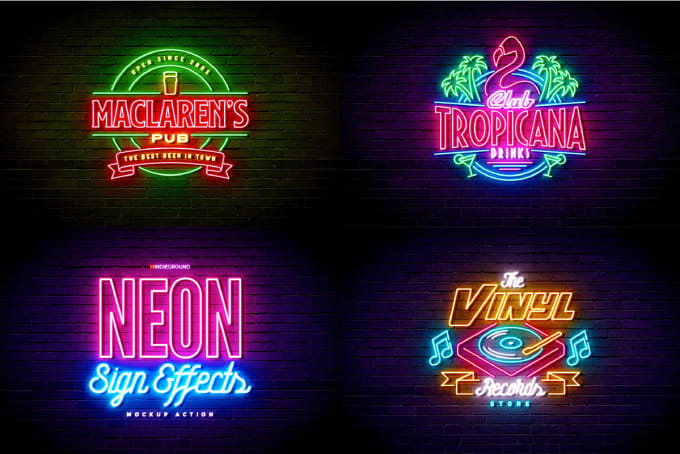
Locate an element on the screen. The width and height of the screenshot is (680, 454). neon signs is located at coordinates (190, 323), (198, 173), (469, 131), (523, 326).